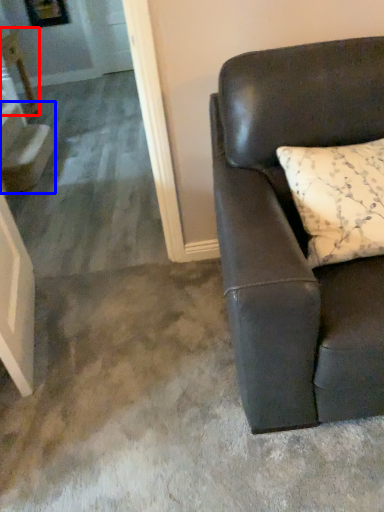
Question: Among these objects, which one is nearest to the camera, table (highlighted by a red box) or stairwell (highlighted by a blue box)?

Choices:
 (A) table
 (B) stairwell

Answer: (B)